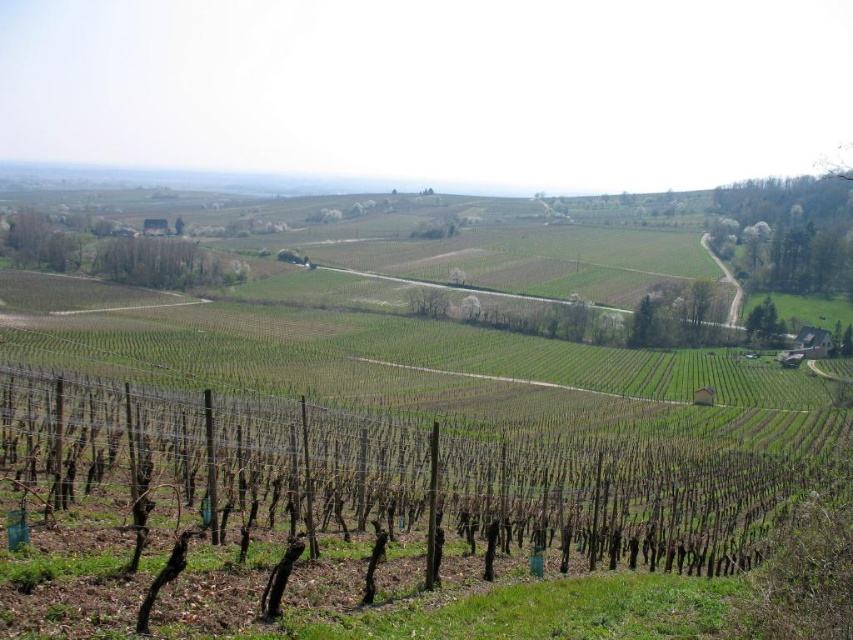
Question: Can you confirm if green leafy tree at upper right is thinner than green leafy trees at upper left?

Choices:
 (A) yes
 (B) no

Answer: (B)

Question: Which object is positioned farthest from the green leafy trees at upper left?

Choices:
 (A) green leafy tree at lower right
 (B) green leafy tree at upper right

Answer: (B)

Question: Which point is farther to the camera?

Choices:
 (A) pyautogui.click(x=138, y=275)
 (B) pyautogui.click(x=747, y=326)

Answer: (A)

Question: Does green leafy tree at upper right lie in front of green leafy tree at lower right?

Choices:
 (A) no
 (B) yes

Answer: (A)

Question: Which object is positioned closest to the green leafy tree at lower right?

Choices:
 (A) green leafy trees at upper left
 (B) green leafy tree at upper right

Answer: (B)

Question: Does green leafy trees at upper left have a larger size compared to green leafy tree at lower right?

Choices:
 (A) yes
 (B) no

Answer: (A)